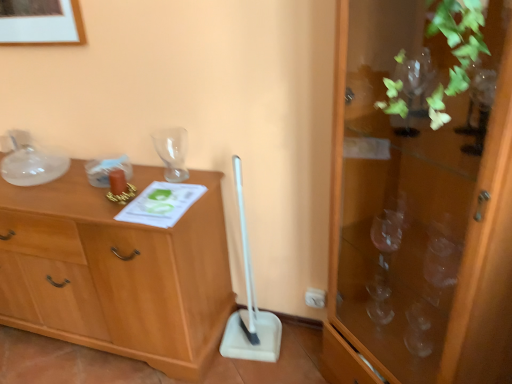
I want to click on free point above wooden chest of drawers at left (from a real-world perspective), so click(79, 183).